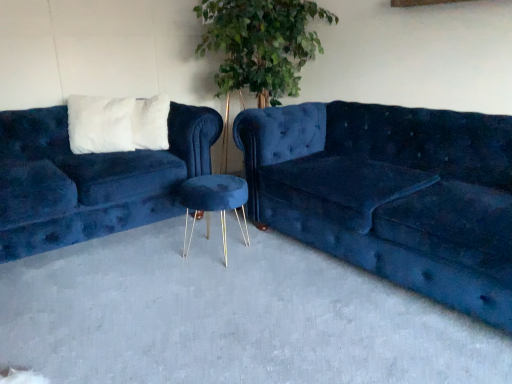
The image size is (512, 384). Find the location of `free space in front of velvet blue couch at left, which ranks as the first studio couch in left-to-right order`. free space in front of velvet blue couch at left, which ranks as the first studio couch in left-to-right order is located at coordinates (118, 295).